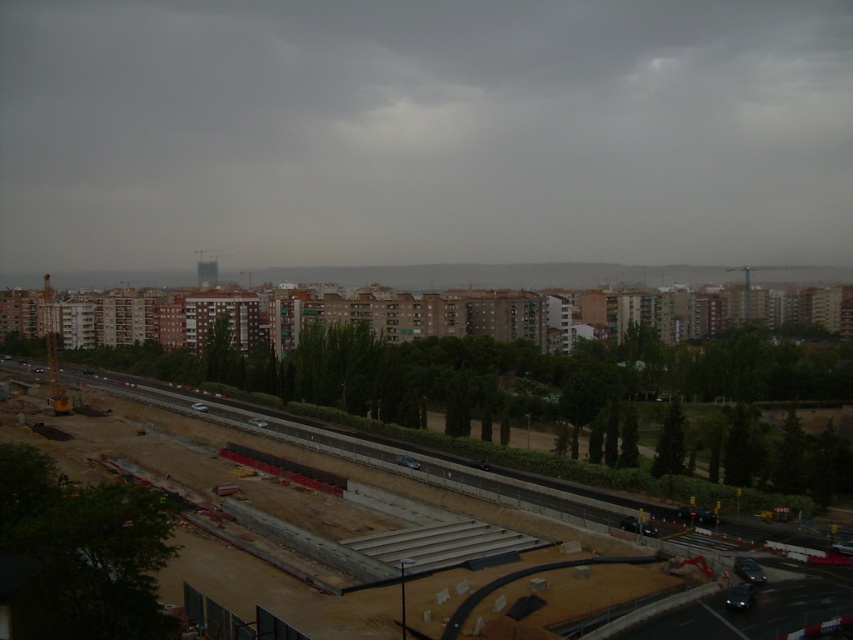
You are a delivery person trying to navigate through the construction site. You see the concrete at center and the green leafy tree at center. Which one do you think is wider?

The concrete at center might be wider than green leafy tree at center according to the description.

You are a city planner assessing the urban layout. You notice the green leafy tree at lower left and the concrete at center. Which of these two has a smaller width?

The green leafy tree at lower left is thinner than the concrete at center, so the green leafy tree at lower left has a smaller width.